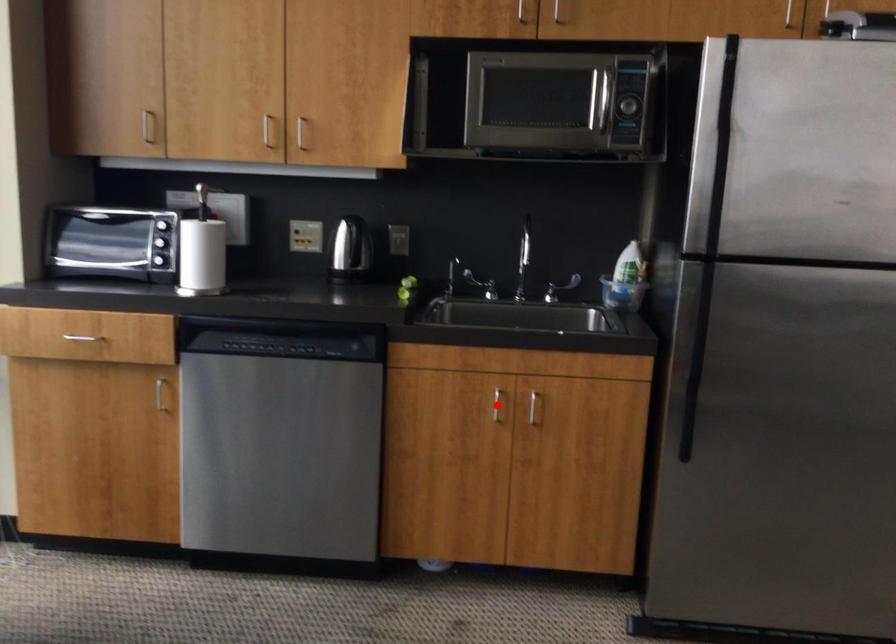
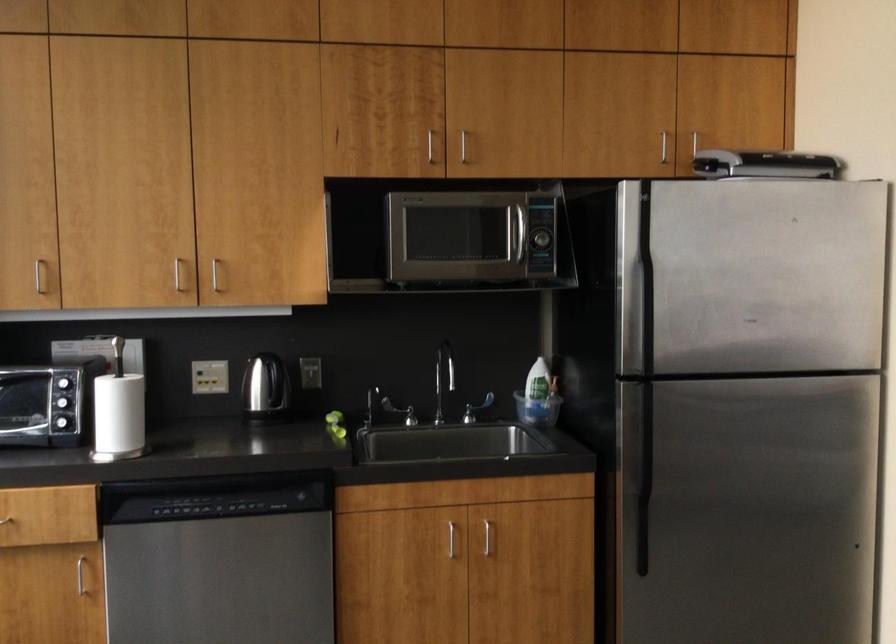
Find the pixel in the second image that matches the highlighted location in the first image.

(450, 538)